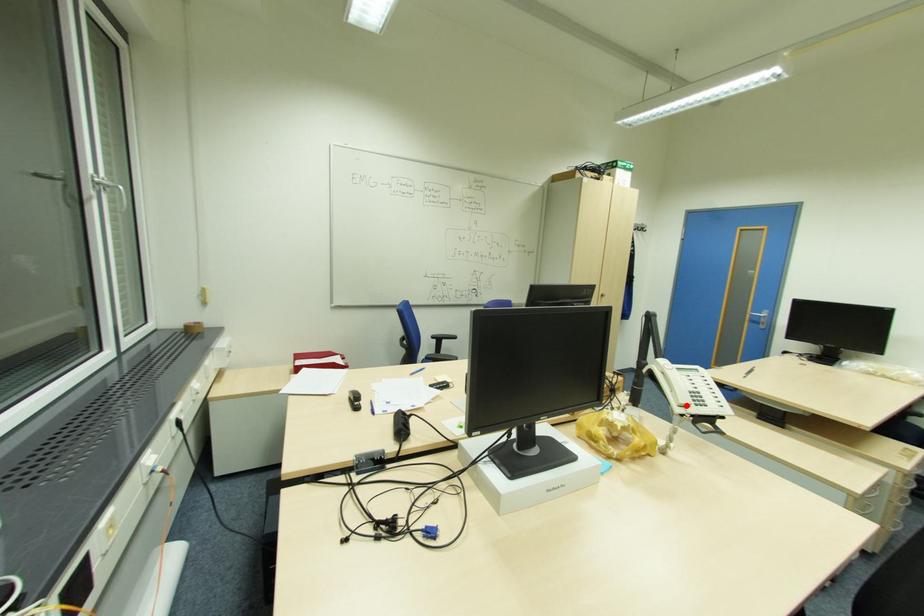
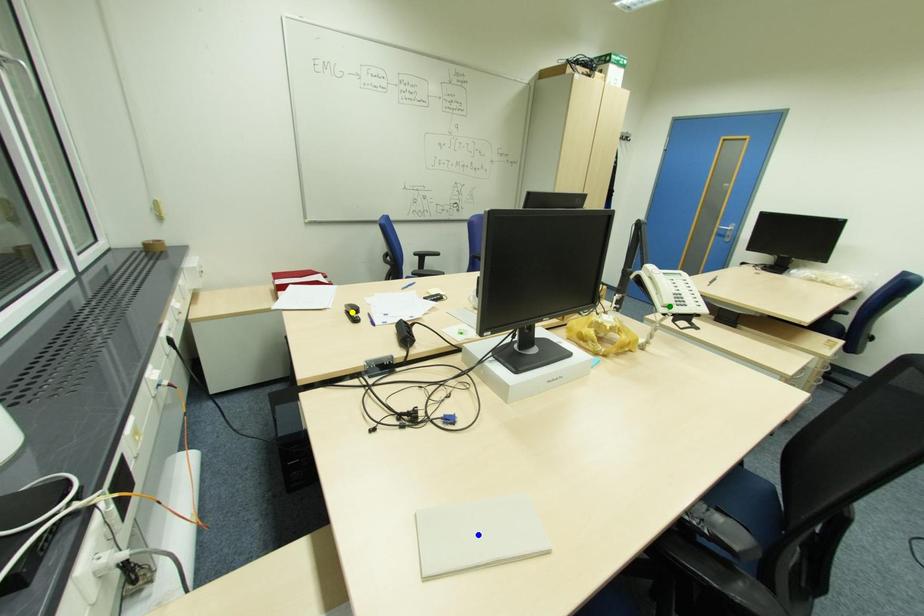
Question: I am providing you with two images of the same scene from different viewpoints. A red point is marked on the first image. You are given multiple points on the second image. Can you choose the point in image 2 that corresponds to the point in image 1?

Choices:
 (A) yellow point
 (B) blue point
 (C) green point

Answer: (C)